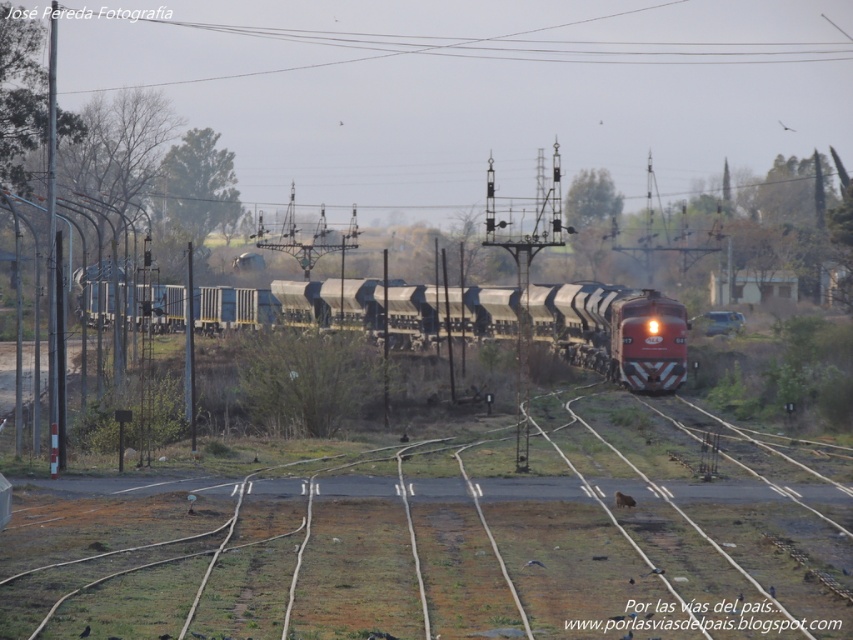
The image size is (853, 640). In order to click on brown dirt track at center in this screenshot , I will do `click(450, 538)`.

Looking at this image, who is taller, brown dirt track at center or metallic freight train at center?

With more height is metallic freight train at center.

Is point (701, 545) farther from camera compared to point (361, 284)?

No, (701, 545) is closer to viewer.

The width and height of the screenshot is (853, 640). What are the coordinates of `brown dirt track at center` in the screenshot? It's located at (450, 538).